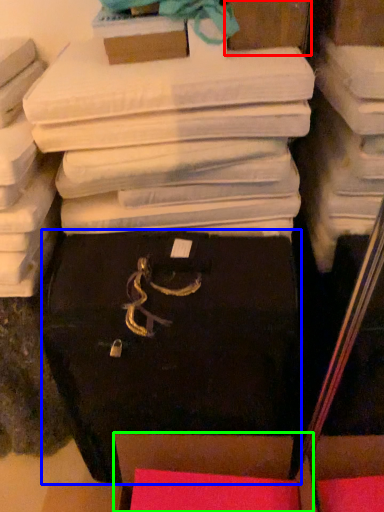
Question: Based on their relative distances, which object is farther from storage box (highlighted by a red box)? Choose from storage box (highlighted by a blue box) and storage box (highlighted by a green box).

Choices:
 (A) storage box
 (B) storage box

Answer: (B)